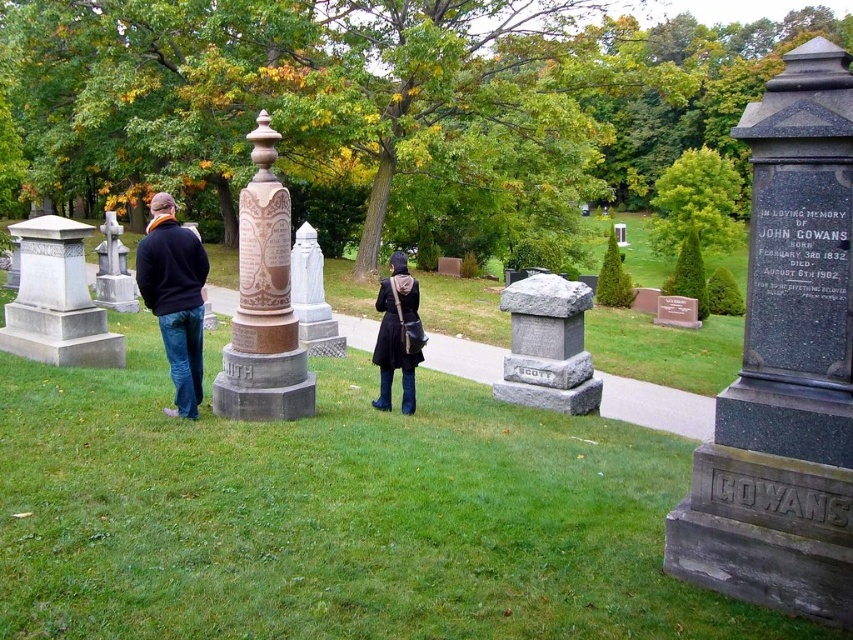
You are standing at the entrance of the cemetery and see the gray stone monument at left and the gray stone gravestone at center. Which one is positioned higher up in the scene?

The gray stone monument at left is located above the gray stone gravestone at center, so it is positioned higher up in the scene.

You are visiting a cemetery and see two memorials, the gray stone monument at left and the smooth gray stone cross at left. Which one is positioned to the right when viewed from your perspective?

A: The gray stone monument at left is positioned to the right of the smooth gray stone cross at left.

You are standing at the point marked as point [57,300] in the cemetery. Which object is this point located on?

The point [57,300] is located on the gray stone monument at left.